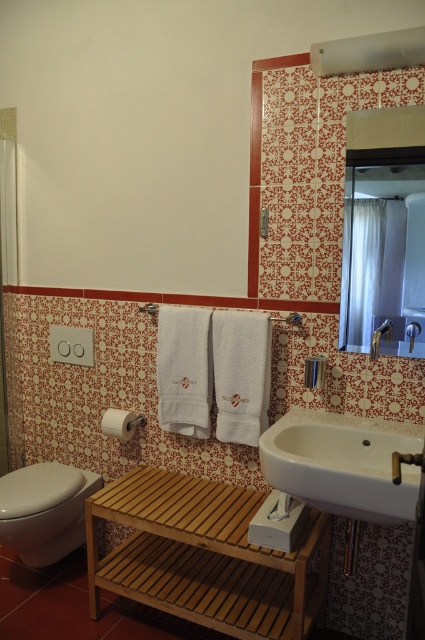
Between point (393, 490) and point (5, 534), which one is positioned behind?

The point (5, 534) is more distant.

Between white ceramic sink at center and white glossy toilet bowl at lower left, which one is positioned higher?

Positioned higher is white ceramic sink at center.

At what (x,y) coordinates should I click in order to perform the action: click on white ceramic sink at center. Please return your answer as a coordinate pair (x, y). Image resolution: width=425 pixels, height=640 pixels. Looking at the image, I should click on (342, 464).

Consider the image. Can you confirm if wooden stool at lower center is positioned above transparent plastic screen door at left?

Incorrect, wooden stool at lower center is not positioned above transparent plastic screen door at left.

Measure the distance between point (x=197, y=504) and camera.

Point (x=197, y=504) is 1.93 meters from camera.

Where is `wooden stool at lower center`? The height and width of the screenshot is (640, 425). wooden stool at lower center is located at coordinates (206, 556).

Image resolution: width=425 pixels, height=640 pixels. Describe the element at coordinates (384, 250) in the screenshot. I see `glossy glass mirror at upper center` at that location.

Does glossy glass mirror at upper center have a smaller size compared to transparent plastic screen door at left?

Yes, glossy glass mirror at upper center is smaller than transparent plastic screen door at left.

Is point (367, 157) farther from camera compared to point (5, 227)?

No.

Where is `glossy glass mirror at upper center`? The height and width of the screenshot is (640, 425). glossy glass mirror at upper center is located at coordinates (384, 250).